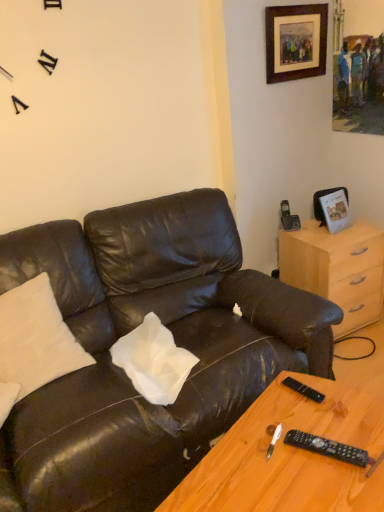
Question: Can you confirm if wooden framed artwork at upper right, the second picture frame in the bottom-to-top sequence, is bigger than black plastic remote at lower right, placed as the first remote when sorted from bottom to top?

Choices:
 (A) yes
 (B) no

Answer: (A)

Question: Can you confirm if wooden framed artwork at upper right, the second picture frame in the bottom-to-top sequence, is taller than black plastic remote at lower right, acting as the 1th remote starting from the front?

Choices:
 (A) no
 (B) yes

Answer: (B)

Question: Does wooden framed artwork at upper right, the second picture frame in the bottom-to-top sequence, come behind black plastic remote at lower right, which is the second remote from top to bottom?

Choices:
 (A) yes
 (B) no

Answer: (A)

Question: Is wooden framed artwork at upper right, the 1th picture frame in the top-to-bottom sequence, at the left side of black plastic remote at lower right, acting as the second remote starting from the back?

Choices:
 (A) no
 (B) yes

Answer: (A)

Question: Would you say wooden framed artwork at upper right, the 1th picture frame in the top-to-bottom sequence, contains black plastic remote at lower right, which is the second remote from top to bottom?

Choices:
 (A) no
 (B) yes

Answer: (A)

Question: In terms of height, does metallic silver photo frame at upper right, the first picture frame positioned from the bottom, look taller or shorter compared to wooden framed artwork at upper right, the 1th picture frame in the top-to-bottom sequence?

Choices:
 (A) short
 (B) tall

Answer: (A)

Question: Based on their sizes in the image, would you say metallic silver photo frame at upper right, the second picture frame in the top-to-bottom sequence, is bigger or smaller than wooden framed artwork at upper right, the 1th picture frame in the top-to-bottom sequence?

Choices:
 (A) big
 (B) small

Answer: (B)

Question: Do you think metallic silver photo frame at upper right, the second picture frame in the top-to-bottom sequence, is within wooden framed artwork at upper right, the second picture frame in the bottom-to-top sequence, or outside of it?

Choices:
 (A) inside
 (B) outside

Answer: (B)

Question: From a real-world perspective, relative to wooden framed artwork at upper right, the 1th picture frame in the top-to-bottom sequence, is metallic silver photo frame at upper right, the second picture frame in the top-to-bottom sequence, vertically above or below?

Choices:
 (A) above
 (B) below

Answer: (B)

Question: From their relative heights in the image, would you say black plastic remote at lower right, which is the second remote from front to back, is taller or shorter than light wood/finish dresser at right?

Choices:
 (A) tall
 (B) short

Answer: (B)

Question: Is black plastic remote at lower right, which is the second remote from front to back, wider or thinner than light wood/finish dresser at right?

Choices:
 (A) thin
 (B) wide

Answer: (A)

Question: Is point (306, 389) positioned closer to the camera than point (334, 233)?

Choices:
 (A) closer
 (B) farther

Answer: (A)

Question: Considering the positions of black plastic remote at lower right, arranged as the 1th remote when viewed from the back, and light wood/finish dresser at right in the image, is black plastic remote at lower right, arranged as the 1th remote when viewed from the back, bigger or smaller than light wood/finish dresser at right?

Choices:
 (A) big
 (B) small

Answer: (B)

Question: Based on their sizes in the image, would you say matte black leather couch at center is bigger or smaller than black plastic remote at lower right, which is the first remote in top-to-bottom order?

Choices:
 (A) small
 (B) big

Answer: (B)

Question: From the image's perspective, is matte black leather couch at center positioned above or below black plastic remote at lower right, arranged as the 1th remote when viewed from the back?

Choices:
 (A) above
 (B) below

Answer: (A)